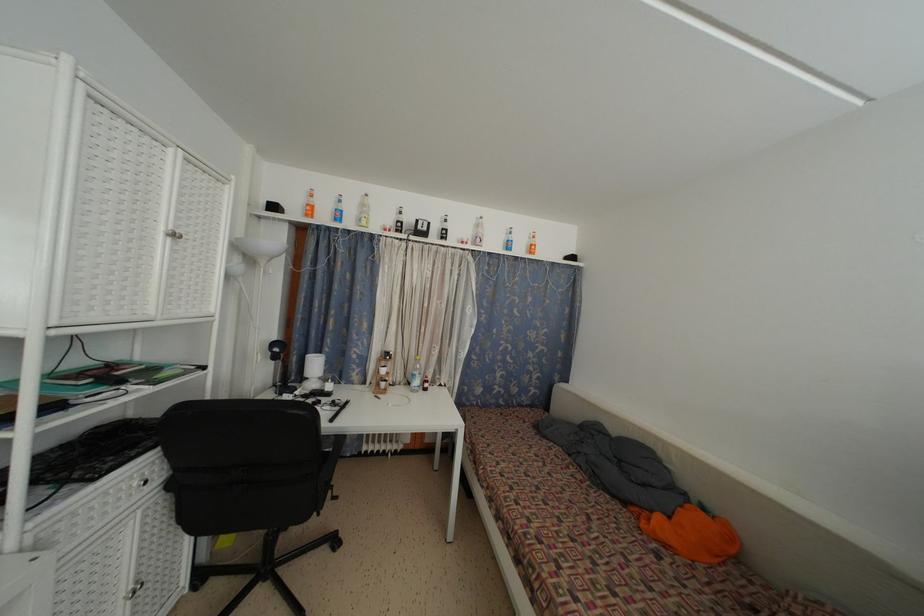
Where would you lift the small white cup? Please return your answer as a coordinate pair (x, y).

(313, 365)